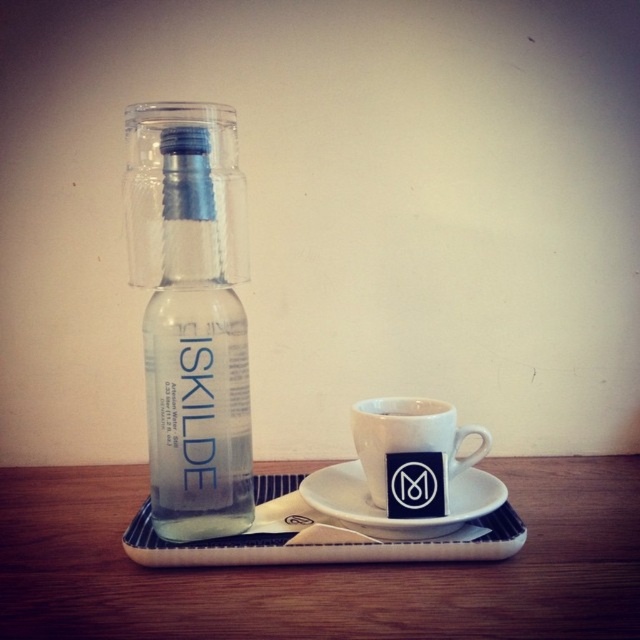
Is wooden table at center bigger than clear glass bottle at left?

Indeed, wooden table at center has a larger size compared to clear glass bottle at left.

Where is `wooden table at center`? This screenshot has height=640, width=640. wooden table at center is located at coordinates (x=323, y=566).

Is wooden table at center further to camera compared to white ceramic saucer at center?

No, wooden table at center is in front of white ceramic saucer at center.

Who is positioned more to the right, wooden table at center or white ceramic saucer at center?

white ceramic saucer at center is more to the right.

Does point (609, 616) lie in front of point (337, 464)?

Yes, it is in front of point (337, 464).

At what (x,y) coordinates should I click in order to perform the action: click on wooden table at center. Please return your answer as a coordinate pair (x, y). The image size is (640, 640). Looking at the image, I should click on coord(323,566).

Is white ceramic mug at lower center bigger than white ceramic saucer at center?

Correct, white ceramic mug at lower center is larger in size than white ceramic saucer at center.

Can you confirm if white ceramic mug at lower center is smaller than white ceramic saucer at center?

No.

Which is behind, point (387, 481) or point (488, 497)?

Point (488, 497)

Image resolution: width=640 pixels, height=640 pixels. Identify the location of white ceramic mug at lower center. [x=410, y=436].